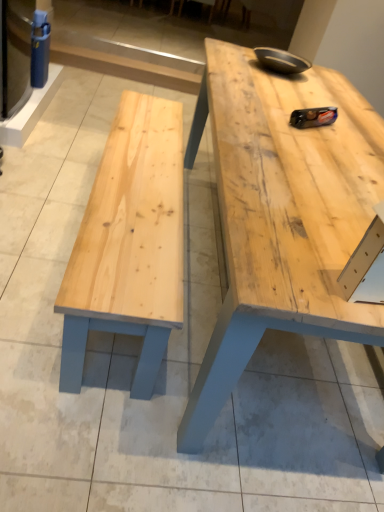
Where is `natural wood table at center`? natural wood table at center is located at coordinates (282, 214).

What do you see at coordinates (282, 214) in the screenshot? The image size is (384, 512). I see `natural wood table at center` at bounding box center [282, 214].

This screenshot has height=512, width=384. Identify the location of natural wood table at center. (282, 214).